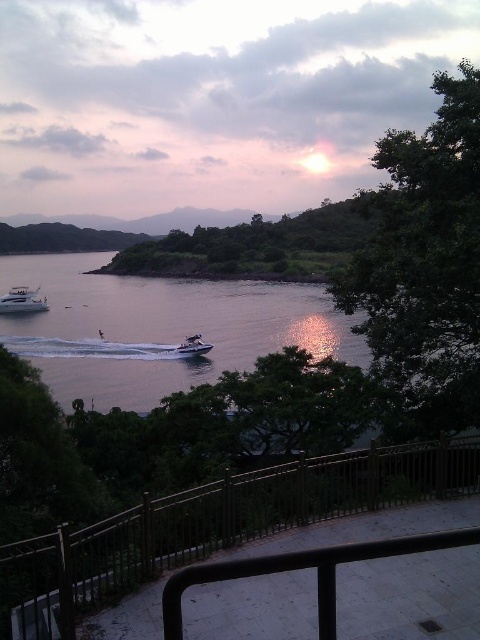
You are standing at the center of the viewing platform and want to take a photo of the white glossy yacht at lower left. Which direction should you face to ensure the yacht is in the lower left corner of your camera frame?

Since the white glossy yacht at lower left is located at point (23,301), you should face towards the lower left direction to position it in the lower left corner of your camera frame.

You are standing at the viewpoint and want to take a photo of the sunrise with the metallic rail at center in the foreground. Where should you position the camera to ensure the rail is centered in the frame?

To center the metallic rail at center in the frame, position the camera at the point corresponding to the coordinates provided in the scene description, which is at point (x=214, y=525).

You are standing on a viewing platform overlooking the coast. You see the metallic rail at center and the clear water at lower left. Which object is nearer to you?

The metallic rail at center is closer to the viewer than the clear water at lower left.